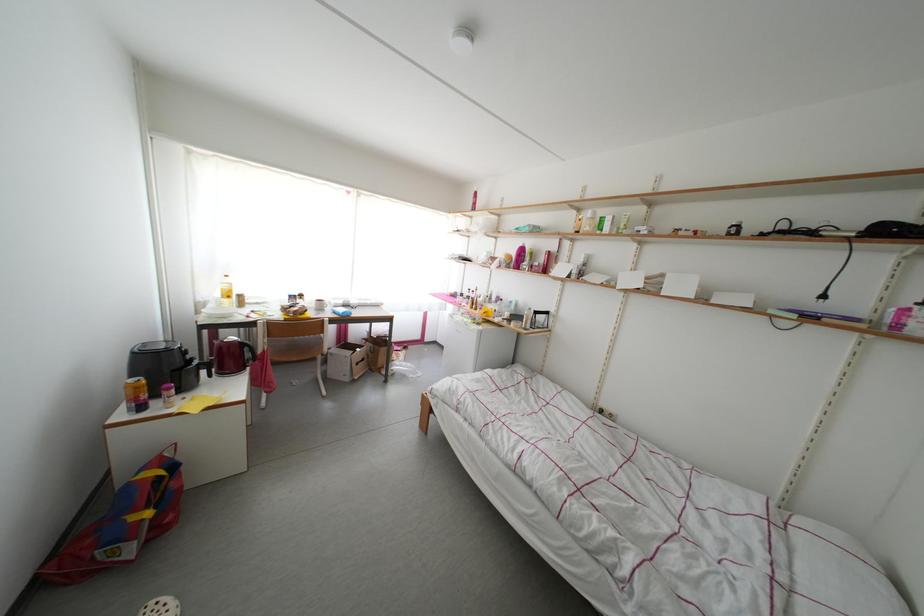
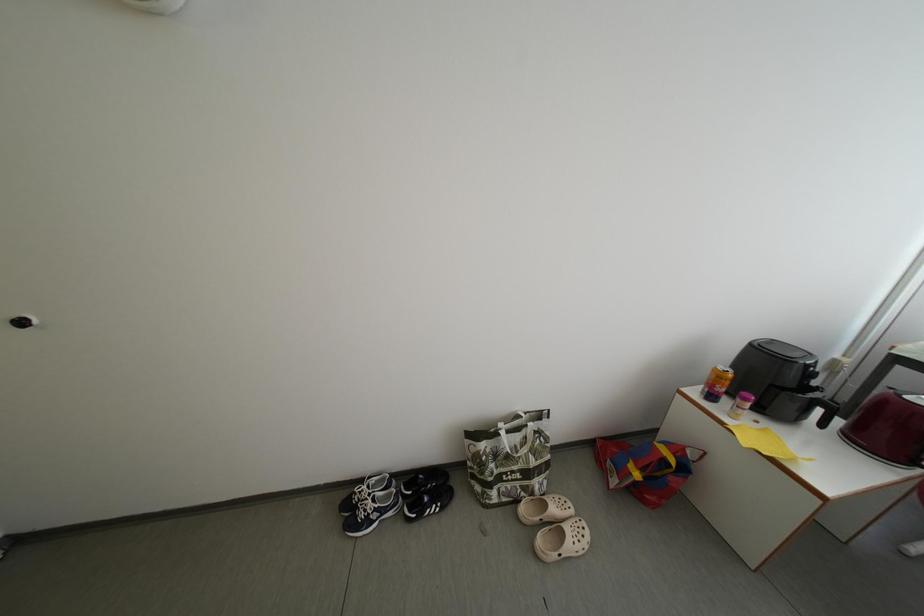
The images are taken continuously from a first-person perspective. In which direction is your viewpoint rotating?

The camera rotated toward left-down.